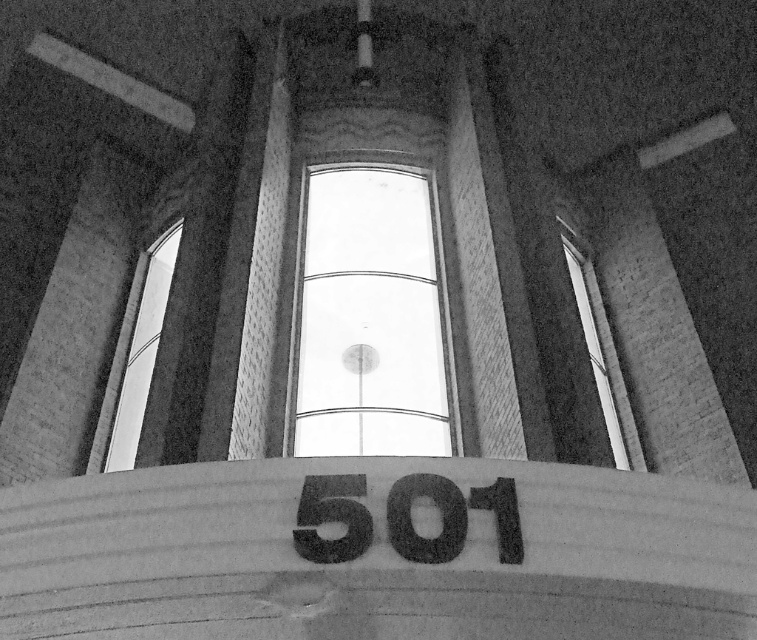
Question: Is transparent glass window at center positioned at the back of transparent glass window at upper center?

Choices:
 (A) yes
 (B) no

Answer: (A)

Question: Which point is closer to the camera taking this photo?

Choices:
 (A) (114, 397)
 (B) (312, 260)
 (C) (617, 429)

Answer: (C)

Question: Which object is closer to the camera taking this photo?

Choices:
 (A) transparent glass window at center
 (B) transparent glass window at left

Answer: (A)

Question: Does transparent glass window at left come behind transparent glass window at upper center?

Choices:
 (A) no
 (B) yes

Answer: (B)

Question: Which of the following is the closest to the observer?

Choices:
 (A) (117, 442)
 (B) (304, 256)

Answer: (A)

Question: Does transparent glass window at left come in front of transparent glass window at upper center?

Choices:
 (A) yes
 (B) no

Answer: (B)